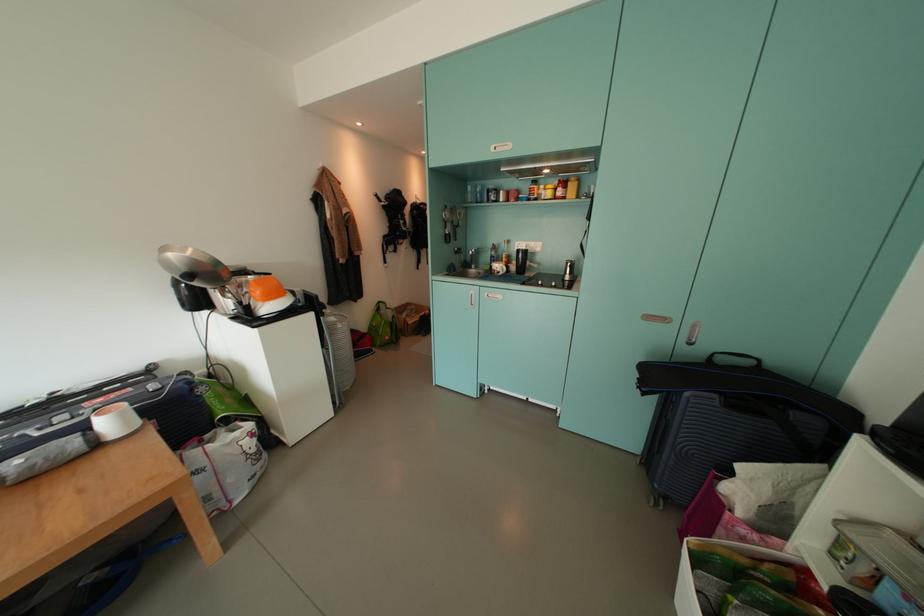
Where would you lift the silver cooking pan? Please return your answer as a coordinate pair (x, y).

(192, 265)